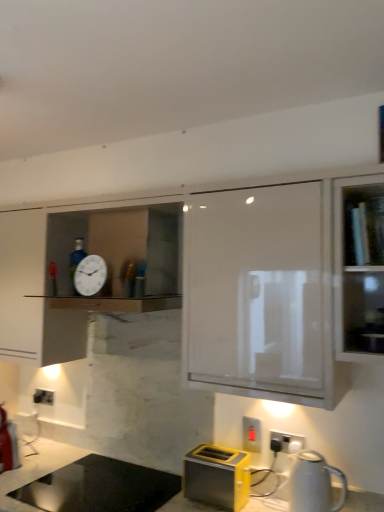
Question: Is clear glass shelf at upper right not inside marble countertop at lower center?

Choices:
 (A) yes
 (B) no

Answer: (A)

Question: From a real-world perspective, is clear glass shelf at upper right beneath marble countertop at lower center?

Choices:
 (A) no
 (B) yes

Answer: (A)

Question: Does clear glass shelf at upper right have a lesser height compared to marble countertop at lower center?

Choices:
 (A) no
 (B) yes

Answer: (B)

Question: From a real-world perspective, is clear glass shelf at upper right positioned over marble countertop at lower center based on gravity?

Choices:
 (A) yes
 (B) no

Answer: (A)

Question: Are clear glass shelf at upper right and marble countertop at lower center far apart?

Choices:
 (A) no
 (B) yes

Answer: (B)

Question: Based on their sizes in the image, would you say marble countertop at lower center is bigger or smaller than white glossy kettle at lower right?

Choices:
 (A) small
 (B) big

Answer: (B)

Question: Is point (16, 482) closer or farther from the camera than point (309, 472)?

Choices:
 (A) farther
 (B) closer

Answer: (A)

Question: From the image's perspective, relative to white glossy kettle at lower right, is marble countertop at lower center above or below?

Choices:
 (A) above
 (B) below

Answer: (B)

Question: Considering the positions of marble countertop at lower center and white glossy kettle at lower right in the image, is marble countertop at lower center wider or thinner than white glossy kettle at lower right?

Choices:
 (A) wide
 (B) thin

Answer: (A)

Question: From the image's perspective, is black plastic electrical outlet at lower center, the third electric outlet when ordered from left to right, above or below white glossy clock at upper center?

Choices:
 (A) below
 (B) above

Answer: (A)

Question: Does point (291, 443) appear closer or farther from the camera than point (89, 259)?

Choices:
 (A) closer
 (B) farther

Answer: (A)

Question: Relative to white glossy clock at upper center, is black plastic electrical outlet at lower center, placed as the third electric outlet when sorted from back to front, in front or behind?

Choices:
 (A) front
 (B) behind

Answer: (B)

Question: Is black plastic electrical outlet at lower center, marked as the first electric outlet in a right-to-left arrangement, taller or shorter than white glossy clock at upper center?

Choices:
 (A) short
 (B) tall

Answer: (A)

Question: Is yellow metallic toaster at lower center taller or shorter than white glossy kettle at lower right?

Choices:
 (A) short
 (B) tall

Answer: (A)

Question: Is yellow metallic toaster at lower center spatially inside white glossy kettle at lower right, or outside of it?

Choices:
 (A) inside
 (B) outside

Answer: (B)